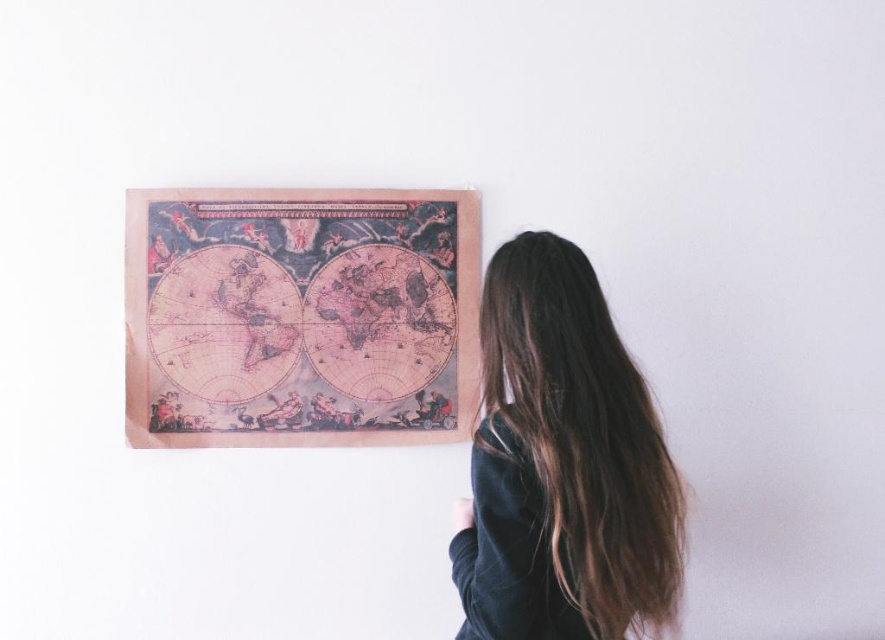
Question: Which point appears closest to the camera in this image?

Choices:
 (A) (199, 216)
 (B) (545, 436)

Answer: (B)

Question: Is vintage paper map at center closer to the viewer compared to dark brown hair at upper right?

Choices:
 (A) yes
 (B) no

Answer: (B)

Question: Can you confirm if vintage paper map at center is smaller than dark brown hair at upper right?

Choices:
 (A) no
 (B) yes

Answer: (B)

Question: From the image, what is the correct spatial relationship of vintage paper map at center in relation to dark brown hair at upper right?

Choices:
 (A) below
 (B) above

Answer: (B)

Question: Among these points, which one is farthest from the camera?

Choices:
 (A) (566, 305)
 (B) (174, 280)

Answer: (B)